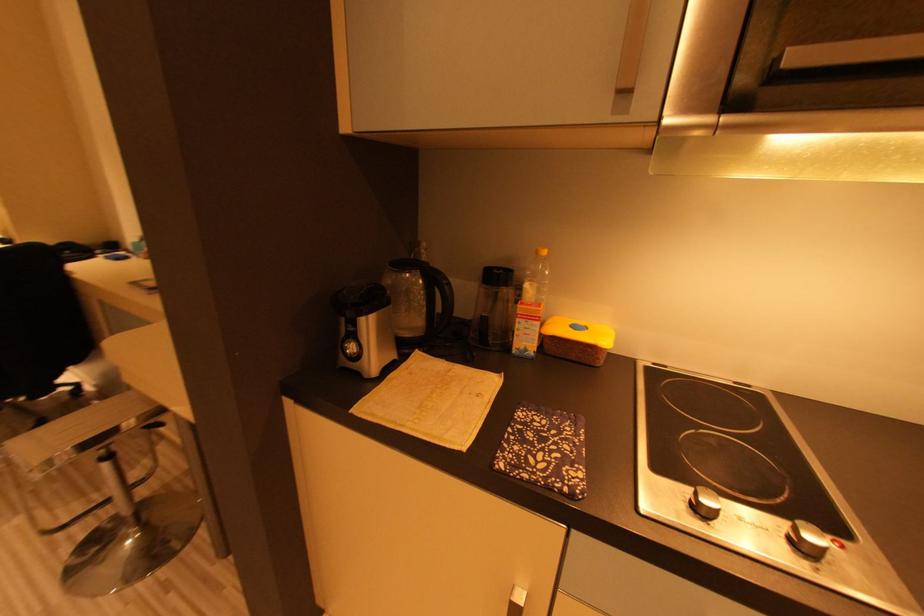
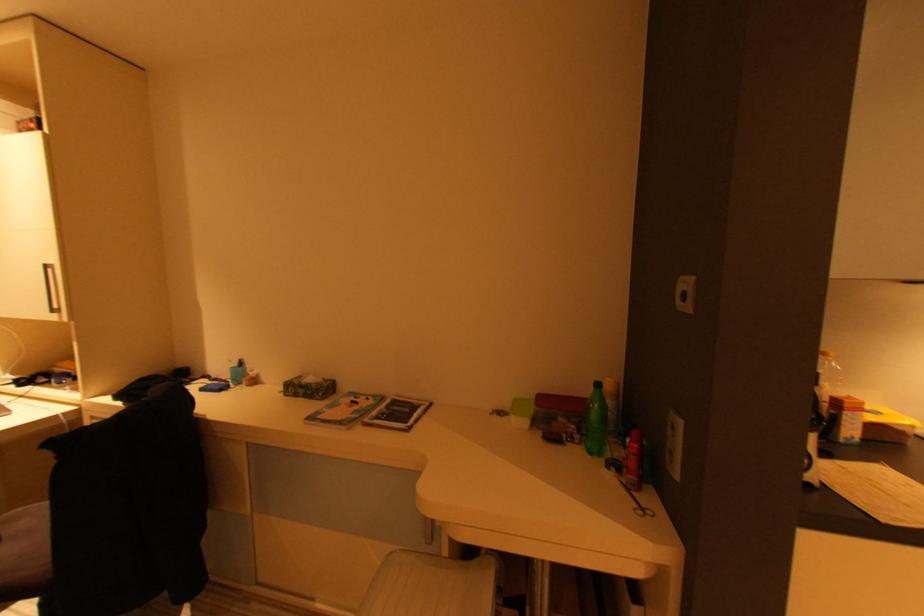
Question: Which direction would the cameraman need to move to produce the second image? Reply with the corresponding letter.

Choices:
 (A) Left
 (B) Right
 (C) Forward
 (D) Backward

Answer: (A)